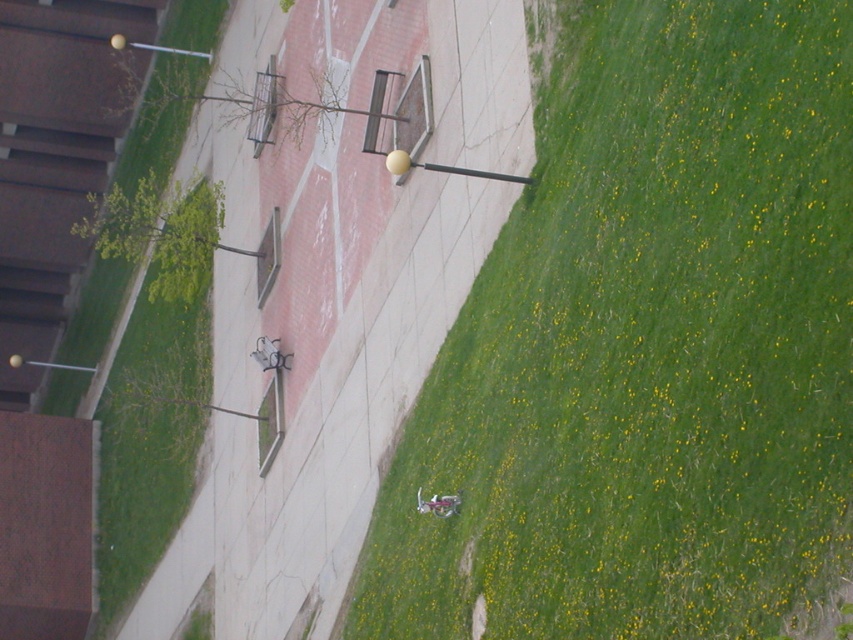
Can you confirm if green grassy at left is taller than pink matte motorcycle at lower center?

Yes.

Is point (172, 412) in front of point (440, 516)?

No.

Locate an element on the screen. green grassy at left is located at coordinates (146, 449).

Does point (614, 156) come in front of point (146, 387)?

Yes, point (614, 156) is in front of point (146, 387).

Does green grassy at lower right appear under green grassy at left?

Indeed, green grassy at lower right is positioned under green grassy at left.

Between point (701, 36) and point (177, 33), which one is positioned behind?

Positioned behind is point (177, 33).

Image resolution: width=853 pixels, height=640 pixels. Find the location of `green grassy at lower right`. green grassy at lower right is located at coordinates (646, 348).

Does green grassy at lower right have a greater height compared to pink matte motorcycle at lower center?

Yes, green grassy at lower right is taller than pink matte motorcycle at lower center.

Is green grassy at lower right shorter than pink matte motorcycle at lower center?

No.

Is point (549, 397) positioned after point (456, 502)?

No.

I want to click on green grassy at lower right, so click(x=646, y=348).